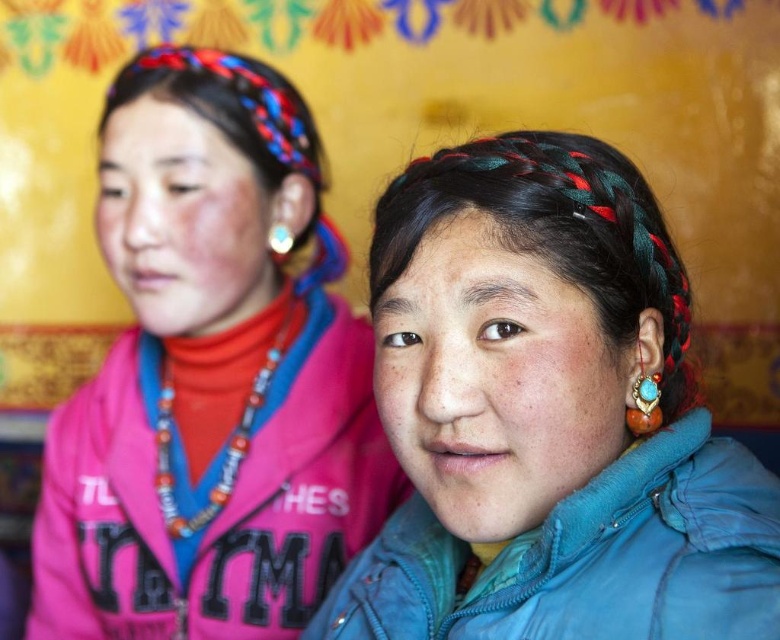
Question: Among these objects, which one is nearest to the camera?

Choices:
 (A) matte pink jacket at left
 (B) turquoise stone ring at ear
 (C) turquoise stone earring at upper left
 (D) beige/wooden beads necklace at left

Answer: (B)

Question: Which object is closer to the camera taking this photo?

Choices:
 (A) beige/wooden beads necklace at left
 (B) blue leather jacket at center
 (C) matte pink jacket at left

Answer: (B)

Question: Can you confirm if beige/wooden beads necklace at left is positioned to the right of turquoise stone ring at ear?

Choices:
 (A) yes
 (B) no

Answer: (B)

Question: Does blue leather jacket at center appear on the right side of blue leather jacket at lower right?

Choices:
 (A) yes
 (B) no

Answer: (A)

Question: Where is blue leather jacket at center located in relation to matte pink jacket at left in the image?

Choices:
 (A) right
 (B) left

Answer: (A)

Question: Which object appears farthest from the camera in this image?

Choices:
 (A) blue leather jacket at center
 (B) blue leather jacket at lower right

Answer: (B)